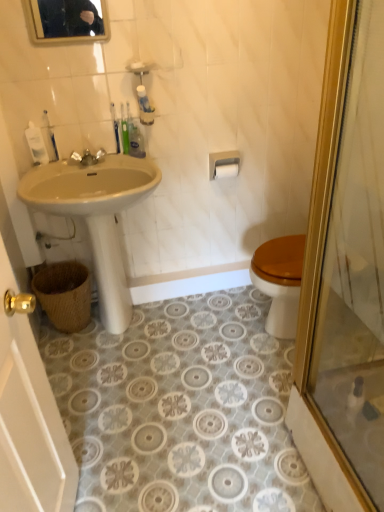
Where is `vacant space to the right of white plastic toothpaste tube at upper left, which is the 2th toiletry from right to left`? Image resolution: width=384 pixels, height=512 pixels. vacant space to the right of white plastic toothpaste tube at upper left, which is the 2th toiletry from right to left is located at coordinates (84, 164).